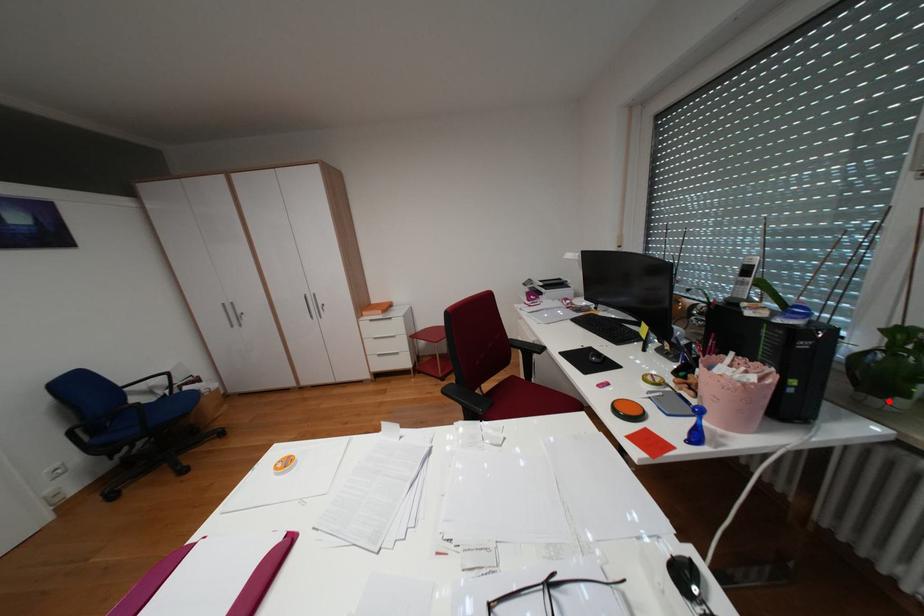
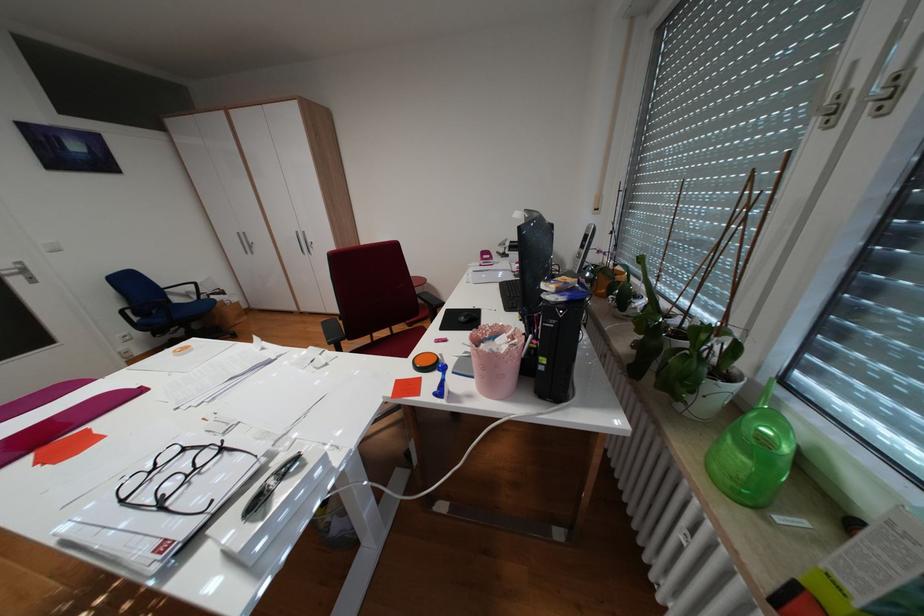
Find the pixel in the second image that matches the highlighted location in the first image.

(691, 405)